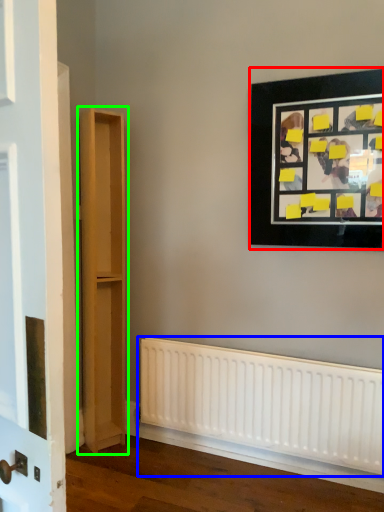
Question: Which object is the farthest from picture frame (highlighted by a red box)? Choose among these: radiator (highlighted by a blue box) or bookshelf (highlighted by a green box).

Choices:
 (A) radiator
 (B) bookshelf

Answer: (B)